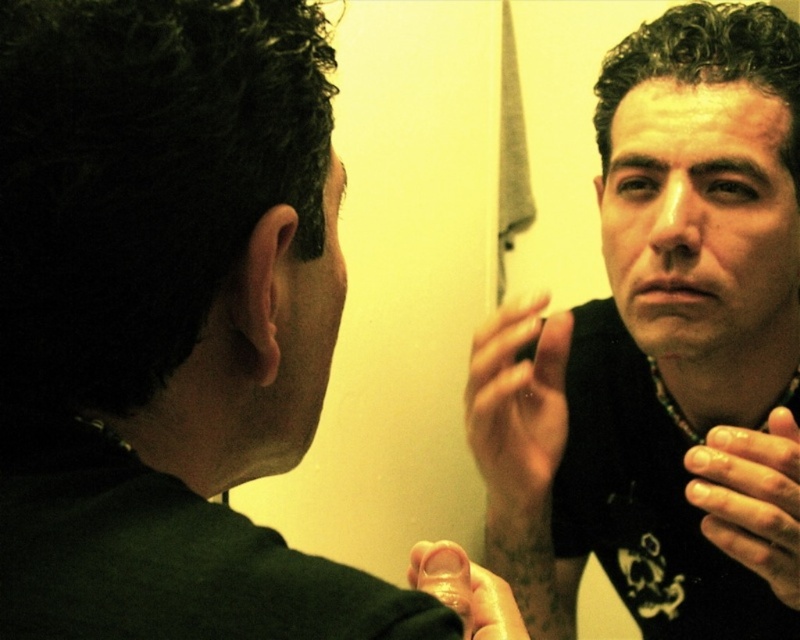
Measure the distance between point (28, 92) and camera.

Point (28, 92) is 12.05 inches from camera.

Does dark green shirt at upper left have a lesser width compared to black matte shirt at center?

Yes.

Measure the distance between dark green shirt at upper left and camera.

They are 10.03 inches apart.

Identify the location of dark green shirt at upper left. The width and height of the screenshot is (800, 640). (168, 321).

Can you confirm if matte black face at center is bigger than dark matte skin at center?

Correct, matte black face at center is larger in size than dark matte skin at center.

Does matte black face at center have a greater width compared to dark matte skin at center?

Yes.

Find the location of a particular element. matte black face at center is located at coordinates (701, 220).

Is point (196, 317) positioned in front of point (272, 432)?

Yes, point (196, 317) is in front of point (272, 432).

Identify the location of dark green shirt at upper left. (168, 321).